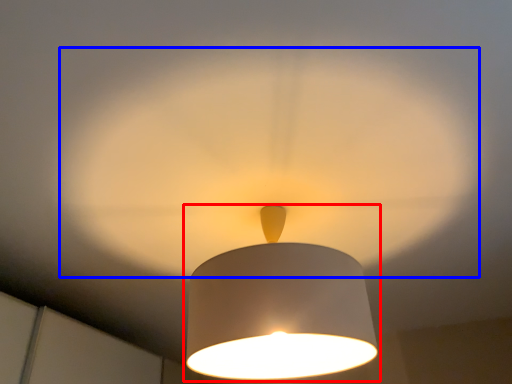
Question: Which object is closer to the camera taking this photo, lamp (highlighted by a red box) or glow (highlighted by a blue box)?

Choices:
 (A) lamp
 (B) glow

Answer: (B)